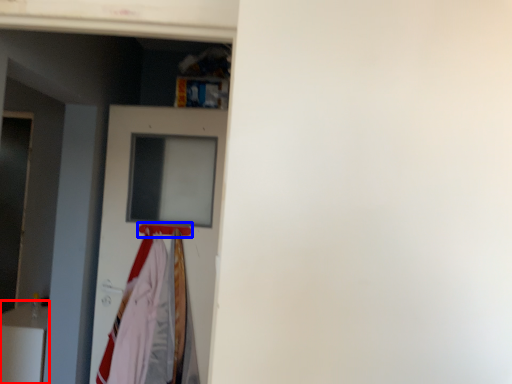
Question: Among these objects, which one is nearest to the camera, furniture (highlighted by a red box) or hanger (highlighted by a blue box)?

Choices:
 (A) furniture
 (B) hanger

Answer: (B)